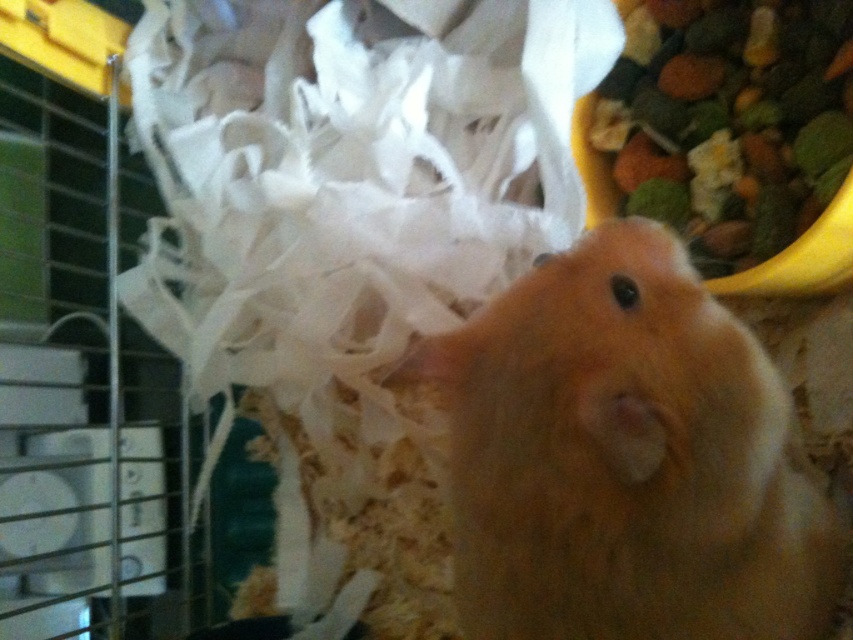
Who is positioned more to the left, fluffy orange hamster at center or multicolored grain mix at upper right?

fluffy orange hamster at center

Does fluffy orange hamster at center appear over multicolored grain mix at upper right?

Actually, fluffy orange hamster at center is below multicolored grain mix at upper right.

Locate an element on the screen. fluffy orange hamster at center is located at coordinates (625, 458).